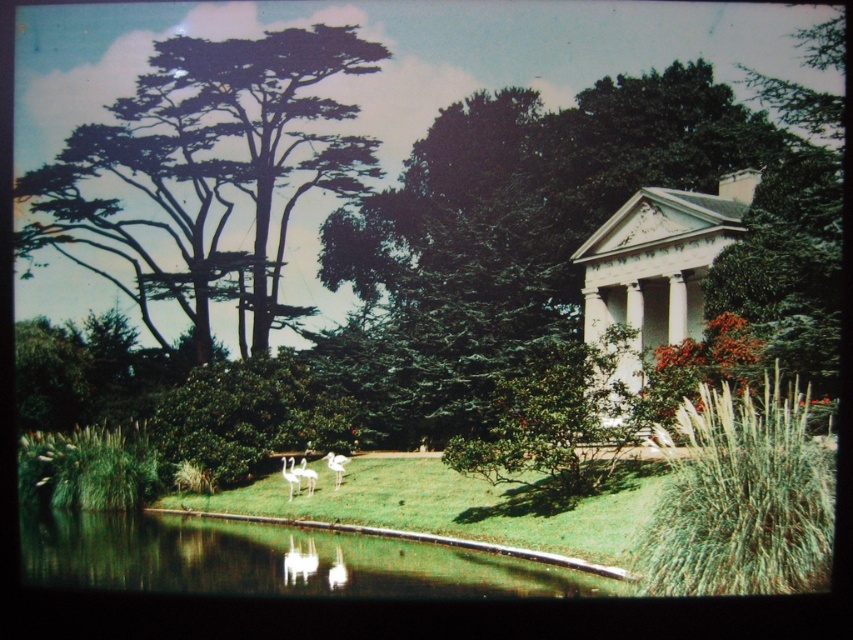
Does clear water at pond center have a lesser width compared to white glossy gazebo at right?

No, clear water at pond center is not thinner than white glossy gazebo at right.

Is clear water at pond center to the right of white glossy gazebo at right from the viewer's perspective?

No, clear water at pond center is not to the right of white glossy gazebo at right.

Does point (248, 573) lie in front of point (584, 337)?

Yes, it is.

Where is `clear water at pond center`? clear water at pond center is located at coordinates click(276, 561).

Can you confirm if green textured tree at upper left is thinner than white glossy gazebo at right?

No.

Image resolution: width=853 pixels, height=640 pixels. What do you see at coordinates (209, 168) in the screenshot?
I see `green textured tree at upper left` at bounding box center [209, 168].

Locate an element on the screen. green textured tree at upper left is located at coordinates (209, 168).

Can you confirm if white fluffy swan at center is thinner than white feathered flamingo at center?

Incorrect, white fluffy swan at center's width is not less than white feathered flamingo at center's.

Which of these two, white fluffy swan at center or white feathered flamingo at center, stands shorter?

Standing shorter between the two is white fluffy swan at center.

Is point (305, 476) positioned after point (281, 458)?

No, it is in front of (281, 458).

In order to click on white fluffy swan at center in this screenshot , I will do `click(305, 474)`.